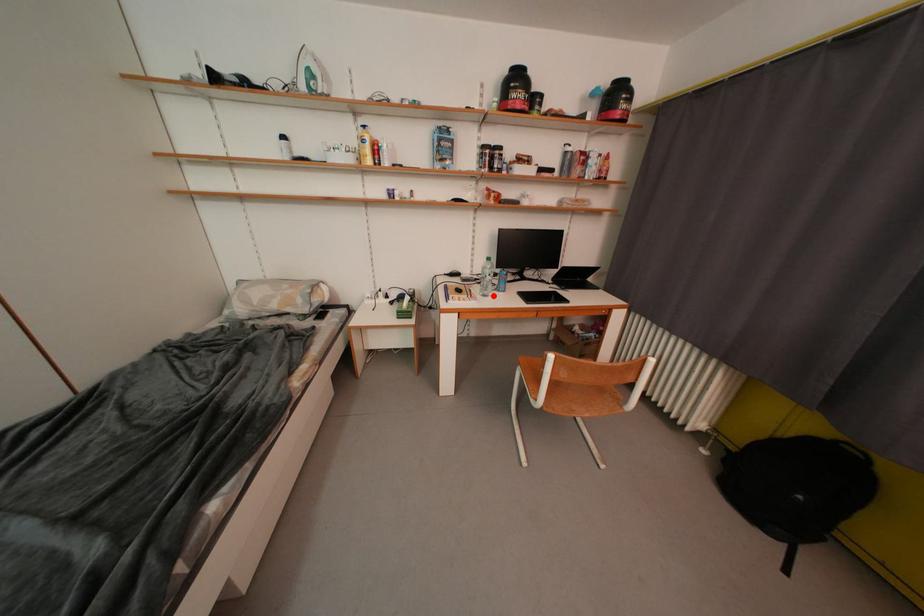
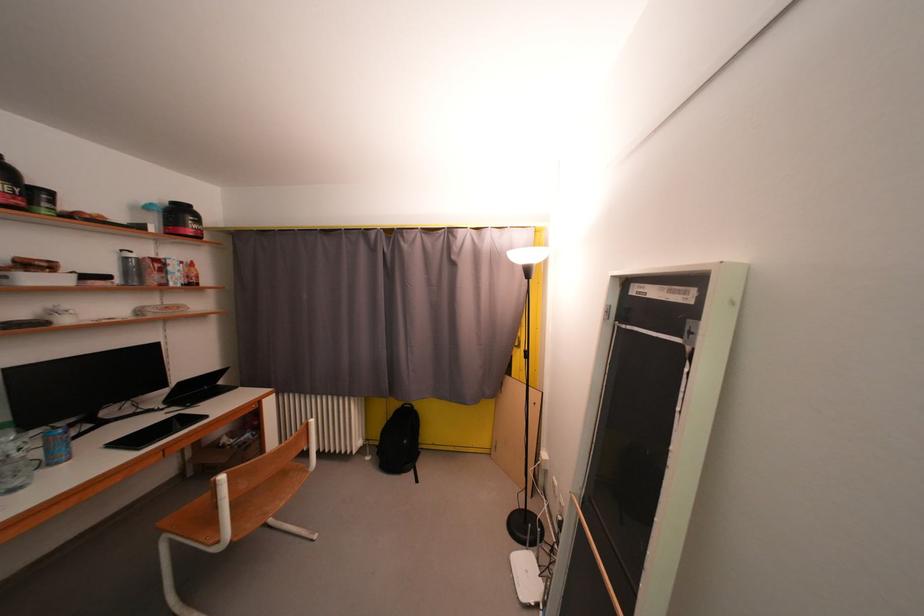
Find the pixel in the second image that matches the highlighted location in the first image.

(25, 487)